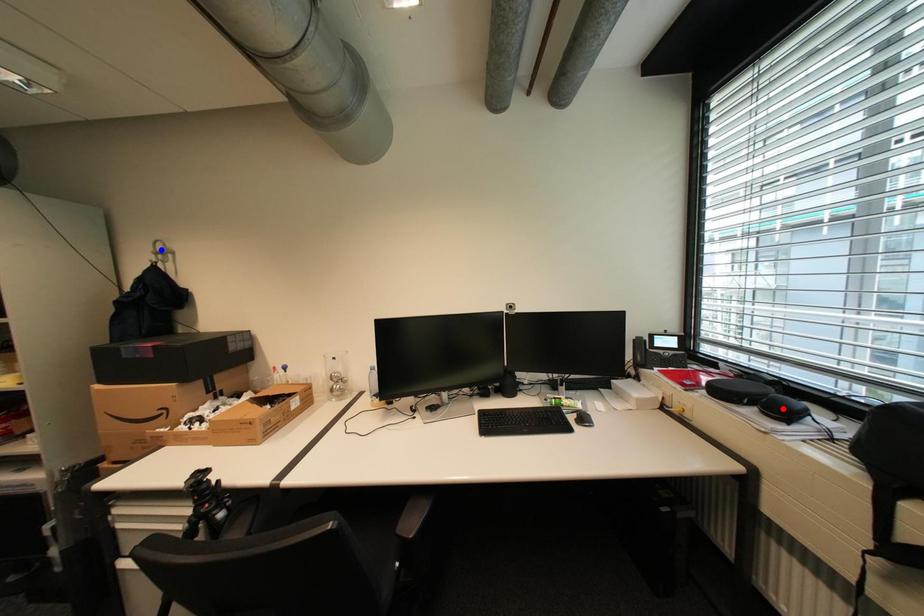
Question: Which of the two points in the image is closer to the camera?

Choices:
 (A) Blue point is closer.
 (B) Red point is closer.

Answer: (B)